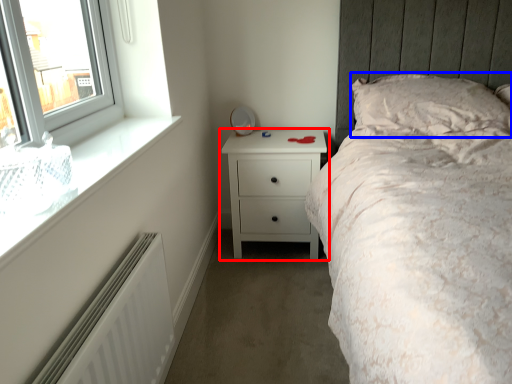
Question: Among these objects, which one is farthest to the camera, chest of drawers (highlighted by a red box) or pillow (highlighted by a blue box)?

Choices:
 (A) chest of drawers
 (B) pillow

Answer: (A)